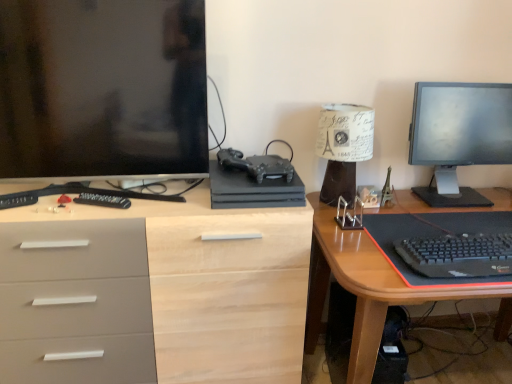
Question: Is white paper lampshade at upper right with matte black monitor at left?

Choices:
 (A) no
 (B) yes

Answer: (A)

Question: From a real-world perspective, does white paper lampshade at upper right sit lower than matte black monitor at left?

Choices:
 (A) no
 (B) yes

Answer: (B)

Question: From a real-world perspective, does white paper lampshade at upper right stand above matte black monitor at left?

Choices:
 (A) no
 (B) yes

Answer: (A)

Question: Does white paper lampshade at upper right have a greater height compared to matte black monitor at left?

Choices:
 (A) yes
 (B) no

Answer: (B)

Question: Does white paper lampshade at upper right turn towards matte black monitor at left?

Choices:
 (A) no
 (B) yes

Answer: (A)

Question: Considering the positions of point (206, 251) and point (357, 145), is point (206, 251) closer or farther from the camera than point (357, 145)?

Choices:
 (A) farther
 (B) closer

Answer: (B)

Question: Is matte wood desk at center, arranged as the second desk when viewed from the right, in front of or behind white paper lampshade at upper right in the image?

Choices:
 (A) front
 (B) behind

Answer: (A)

Question: Which is correct: matte wood desk at center, the first desk viewed from the left, is inside white paper lampshade at upper right, or outside of it?

Choices:
 (A) outside
 (B) inside

Answer: (A)

Question: From a real-world perspective, is matte wood desk at center, the first desk viewed from the left, positioned above or below white paper lampshade at upper right?

Choices:
 (A) below
 (B) above

Answer: (A)

Question: From the image's perspective, is white paper lampshade at upper right located above or below wooden desk at right, positioned as the 2th desk in left-to-right order?

Choices:
 (A) above
 (B) below

Answer: (A)

Question: Do you think white paper lampshade at upper right is within wooden desk at right, positioned as the 2th desk in left-to-right order, or outside of it?

Choices:
 (A) outside
 (B) inside

Answer: (A)

Question: Considering the relative positions of white paper lampshade at upper right and wooden desk at right, which ranks as the 1th desk in right-to-left order, in the image provided, is white paper lampshade at upper right to the left or to the right of wooden desk at right, which ranks as the 1th desk in right-to-left order,?

Choices:
 (A) left
 (B) right

Answer: (A)

Question: From a real-world perspective, is white paper lampshade at upper right physically located above or below wooden desk at right, positioned as the 2th desk in left-to-right order?

Choices:
 (A) below
 (B) above

Answer: (B)

Question: From a real-world perspective, is black plastic remote control at left, which is counted as the 1th remote control, starting from the right, physically located above or below matte black gaming console at center?

Choices:
 (A) below
 (B) above

Answer: (A)

Question: Considering the positions of point (81, 201) and point (297, 200), is point (81, 201) closer or farther from the camera than point (297, 200)?

Choices:
 (A) closer
 (B) farther

Answer: (A)